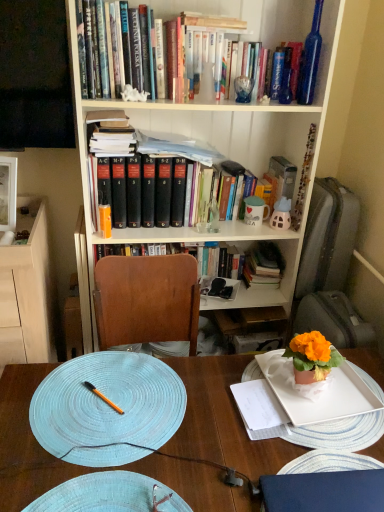
Question: Can you confirm if orange glossy pen at center is taller than light wood cabinet at left?

Choices:
 (A) no
 (B) yes

Answer: (A)

Question: From the image's perspective, is orange glossy pen at center located above light wood cabinet at left?

Choices:
 (A) no
 (B) yes

Answer: (A)

Question: Is orange glossy pen at center positioned with its back to light wood cabinet at left?

Choices:
 (A) no
 (B) yes

Answer: (A)

Question: Can you confirm if orange glossy pen at center is smaller than light wood cabinet at left?

Choices:
 (A) no
 (B) yes

Answer: (B)

Question: Is orange glossy pen at center closer to camera compared to light wood cabinet at left?

Choices:
 (A) no
 (B) yes

Answer: (B)

Question: From a real-world perspective, relative to white paper notebook at center, is blue woven placemat at center vertically above or below?

Choices:
 (A) above
 (B) below

Answer: (B)

Question: From the image's perspective, is blue woven placemat at center above or below white paper notebook at center?

Choices:
 (A) above
 (B) below

Answer: (B)

Question: Does point (18, 419) appear closer or farther from the camera than point (271, 416)?

Choices:
 (A) farther
 (B) closer

Answer: (B)

Question: Is blue woven placemat at center in front of or behind white paper notebook at center in the image?

Choices:
 (A) front
 (B) behind

Answer: (A)

Question: Is white woven placemat at lower center, the second plate when ordered from right to left, situated inside black glossy television at upper left or outside?

Choices:
 (A) inside
 (B) outside

Answer: (B)

Question: In terms of size, does white woven placemat at lower center, the second plate when ordered from right to left, appear bigger or smaller than black glossy television at upper left?

Choices:
 (A) small
 (B) big

Answer: (A)

Question: Considering the relative positions of white woven placemat at lower center, which ranks as the 2th plate in left-to-right order, and black glossy television at upper left in the image provided, is white woven placemat at lower center, which ranks as the 2th plate in left-to-right order, to the left or to the right of black glossy television at upper left?

Choices:
 (A) right
 (B) left

Answer: (A)

Question: From a real-world perspective, is white woven placemat at lower center, the second plate when ordered from right to left, above or below black glossy television at upper left?

Choices:
 (A) below
 (B) above

Answer: (A)

Question: Is black glossy television at upper left bigger or smaller than white matte bookcase at upper center?

Choices:
 (A) small
 (B) big

Answer: (A)

Question: Do you think black glossy television at upper left is within white matte bookcase at upper center, or outside of it?

Choices:
 (A) outside
 (B) inside

Answer: (A)